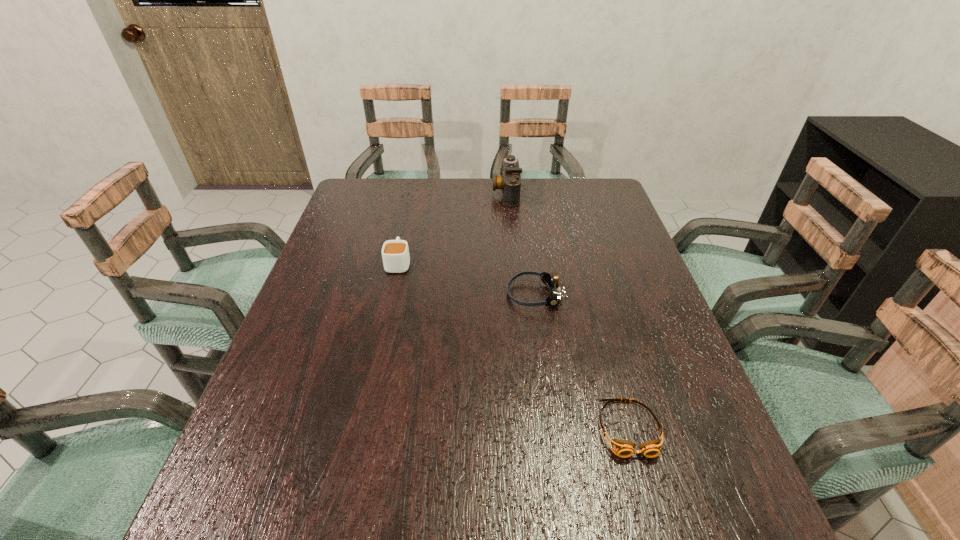
Find the location of a particular element. This screenshot has width=960, height=540. vacant space located on the lens of the farthest object is located at coordinates click(x=438, y=192).

Where is `free space located 0.120m on the side with the handle of the leftmost object`? This screenshot has height=540, width=960. free space located 0.120m on the side with the handle of the leftmost object is located at coordinates (406, 228).

I want to click on vacant space located 0.170m on the side with the handle of the leftmost object, so click(408, 219).

Find the location of a particular element. The height and width of the screenshot is (540, 960). vacant space located 0.400m on the side with the handle of the leftmost object is located at coordinates (416, 183).

Find the location of `free region located through the lenses of the second nearest object`. free region located through the lenses of the second nearest object is located at coordinates (421, 294).

Where is `free space located through the lenses of the second nearest object`? The height and width of the screenshot is (540, 960). free space located through the lenses of the second nearest object is located at coordinates (453, 294).

You are a GUI agent. You are given a task and a screenshot of the screen. Output one action in this format:
    pyautogui.click(x=<x>, y=<y>)
    Task: Click on the free space located through the lenses of the second nearest object
    The height and width of the screenshot is (540, 960).
    Given the screenshot: What is the action you would take?
    pyautogui.click(x=360, y=294)

The image size is (960, 540). I want to click on free space located 0.120m with the lenses facing forward on the rightmost object, so click(657, 530).

The image size is (960, 540). In order to click on object situated at the far edge in this screenshot , I will do `click(510, 182)`.

Identify the location of object at the right edge. [x=624, y=449].